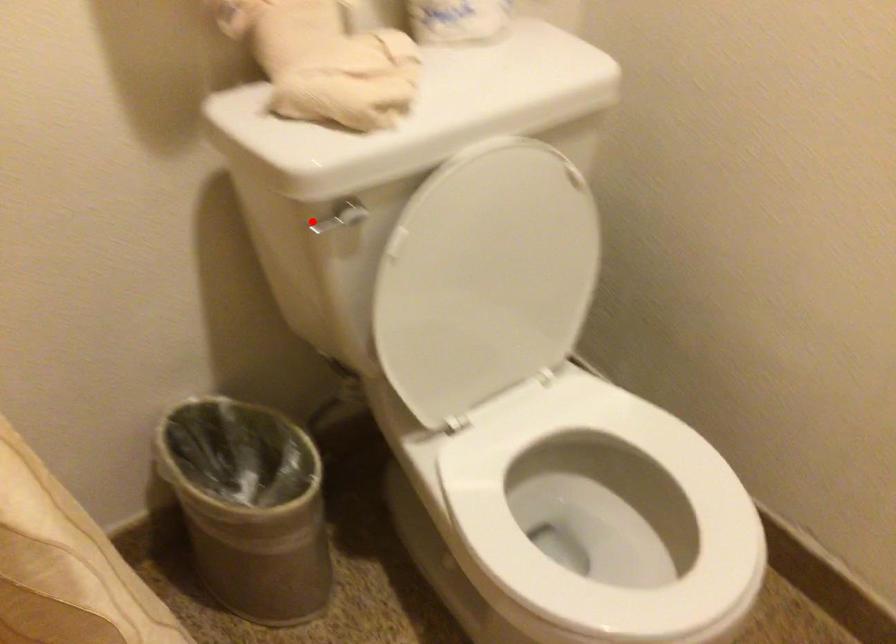
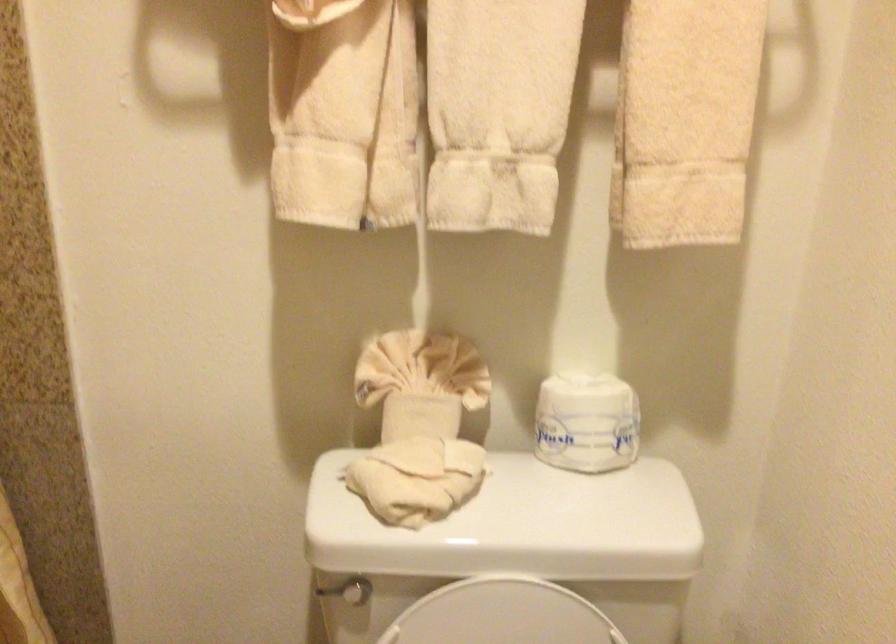
Question: A red point is marked in image1. In image2, is the corresponding 3D point closer to the camera or farther? Reply with the corresponding letter.

Choices:
 (A) The corresponding 3D point is closer.
 (B) The corresponding 3D point is farther.

Answer: (B)